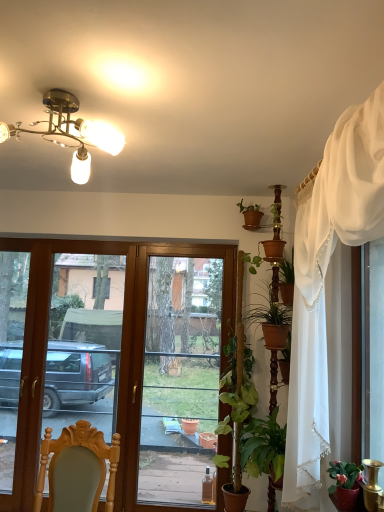
Question: Is transparent glass door at center spatially inside green leafy plant at center-right, or outside of it?

Choices:
 (A) outside
 (B) inside

Answer: (A)

Question: Visually, is transparent glass door at center positioned to the left or to the right of green leafy plant at center-right?

Choices:
 (A) right
 (B) left

Answer: (B)

Question: Which is nearer to the matte brown pot at upper center, the 1th houseplant from the top?

Choices:
 (A) matte brass chandelier at upper center
 (B) matte red pot at lower right, placed as the 3th houseplant when sorted from back to front
 (C) green matte plant at right, the 3th houseplant in the top-to-bottom sequence
 (D) green leafy plant at center-right
 (E) transparent glass door at center

Answer: (D)

Question: Which of these objects is positioned farthest from the wooden chair at lower left?

Choices:
 (A) brown wooden screen door at left
 (B) matte brown pot at upper center, which appears as the second houseplant when viewed from the left
 (C) green leafy plant at center-right
 (D) transparent glass door at center
 (E) green matte plant at right, the 3th houseplant in the top-to-bottom sequence

Answer: (A)